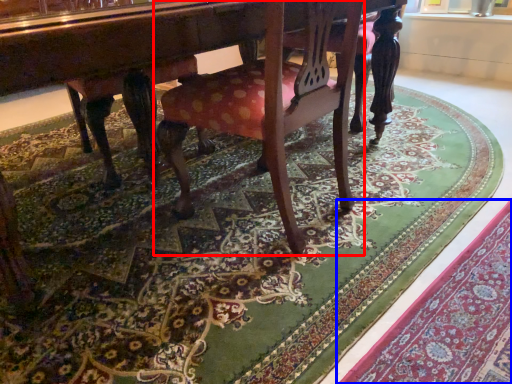
Question: Which object is further to the camera taking this photo, chair (highlighted by a red box) or mat (highlighted by a blue box)?

Choices:
 (A) chair
 (B) mat

Answer: (A)